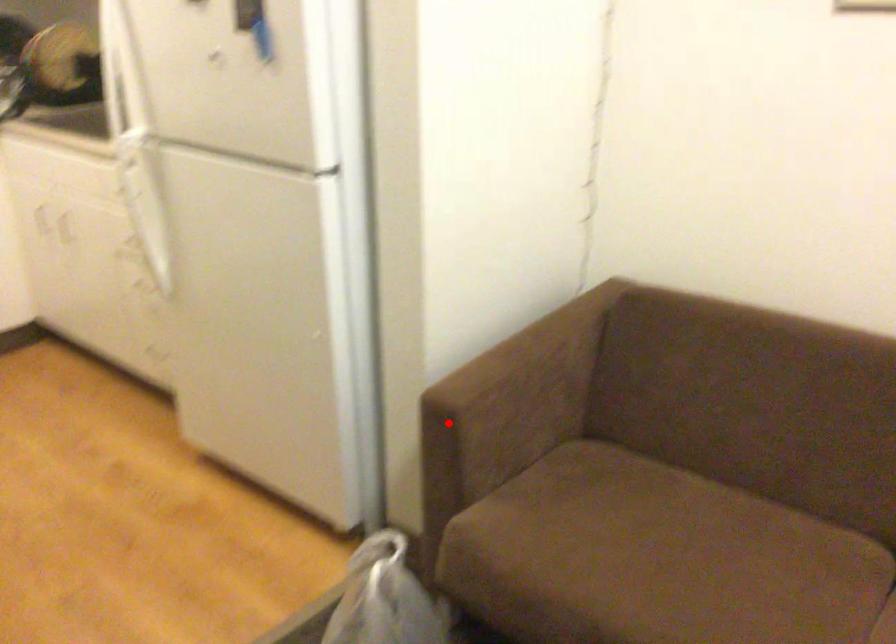
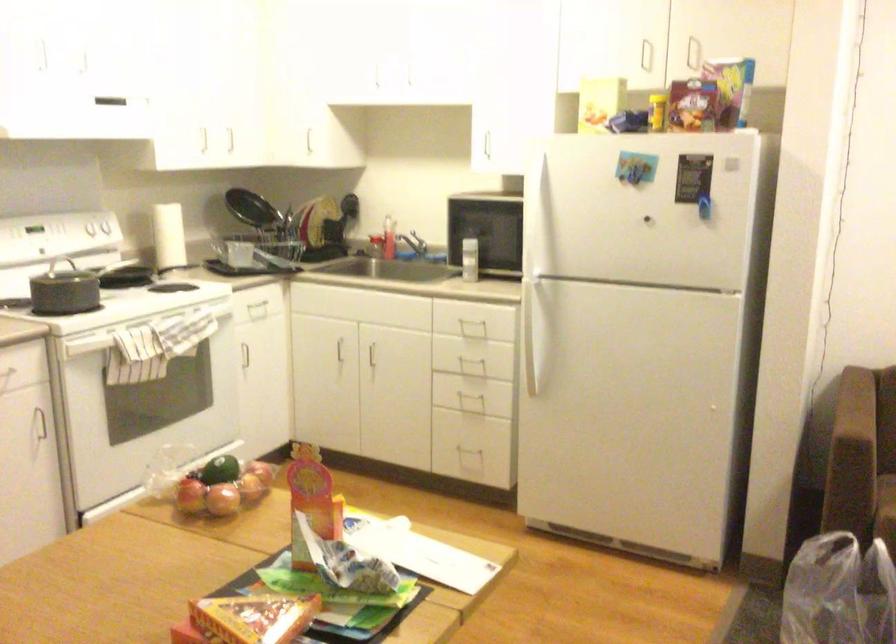
Question: I am providing you with two images of the same scene from different viewpoints. Given a red point in image1, look at the same physical point in image2. Is it:

Choices:
 (A) Closer to the viewpoint
 (B) Farther from the viewpoint

Answer: (B)